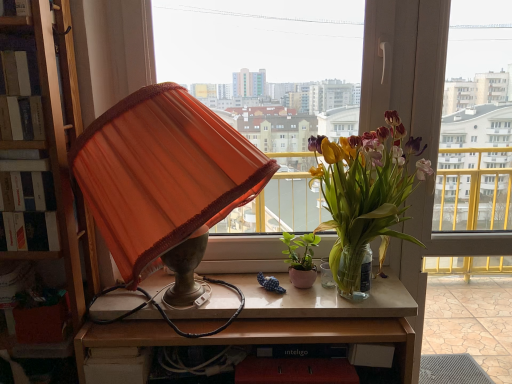
Question: Can you confirm if transparent glass window at center, the 2th window viewed from the right, is bigger than transparent glass window at center, placed as the first window when sorted from right to left?

Choices:
 (A) no
 (B) yes

Answer: (A)

Question: Considering the relative positions of transparent glass window at center, placed as the first window when sorted from left to right, and transparent glass window at center, the 2th window viewed from the left, in the image provided, is transparent glass window at center, placed as the first window when sorted from left to right, to the left of transparent glass window at center, the 2th window viewed from the left, from the viewer's perspective?

Choices:
 (A) no
 (B) yes

Answer: (B)

Question: Does transparent glass window at center, placed as the first window when sorted from left to right, turn towards transparent glass window at center, the 2th window viewed from the left?

Choices:
 (A) yes
 (B) no

Answer: (B)

Question: From a real-world perspective, is transparent glass window at center, the 2th window viewed from the right, physically above transparent glass window at center, placed as the first window when sorted from right to left?

Choices:
 (A) no
 (B) yes

Answer: (B)

Question: From the image's perspective, would you say transparent glass window at center, the 2th window viewed from the right, is shown under transparent glass window at center, placed as the first window when sorted from right to left?

Choices:
 (A) no
 (B) yes

Answer: (A)

Question: Considering the relative sizes of transparent glass window at center, the 2th window viewed from the right, and transparent glass window at center, placed as the first window when sorted from right to left, in the image provided, is transparent glass window at center, the 2th window viewed from the right, taller than transparent glass window at center, placed as the first window when sorted from right to left,?

Choices:
 (A) yes
 (B) no

Answer: (B)

Question: From the image's perspective, would you say hardcover book at left is positioned over transparent glass window at center, placed as the first window when sorted from right to left?

Choices:
 (A) yes
 (B) no

Answer: (A)

Question: Is hardcover book at left aimed at transparent glass window at center, placed as the first window when sorted from right to left?

Choices:
 (A) no
 (B) yes

Answer: (A)

Question: Does hardcover book at left have a lesser height compared to transparent glass window at center, placed as the first window when sorted from right to left?

Choices:
 (A) yes
 (B) no

Answer: (A)

Question: Can you confirm if hardcover book at left is positioned to the left of transparent glass window at center, placed as the first window when sorted from right to left?

Choices:
 (A) yes
 (B) no

Answer: (A)

Question: Is the depth of hardcover book at left greater than that of transparent glass window at center, placed as the first window when sorted from right to left?

Choices:
 (A) yes
 (B) no

Answer: (B)

Question: Is hardcover book at left oriented away from transparent glass window at center, placed as the first window when sorted from right to left?

Choices:
 (A) yes
 (B) no

Answer: (B)

Question: Is wooden table at center closer to camera compared to hardcover book at left?

Choices:
 (A) yes
 (B) no

Answer: (B)